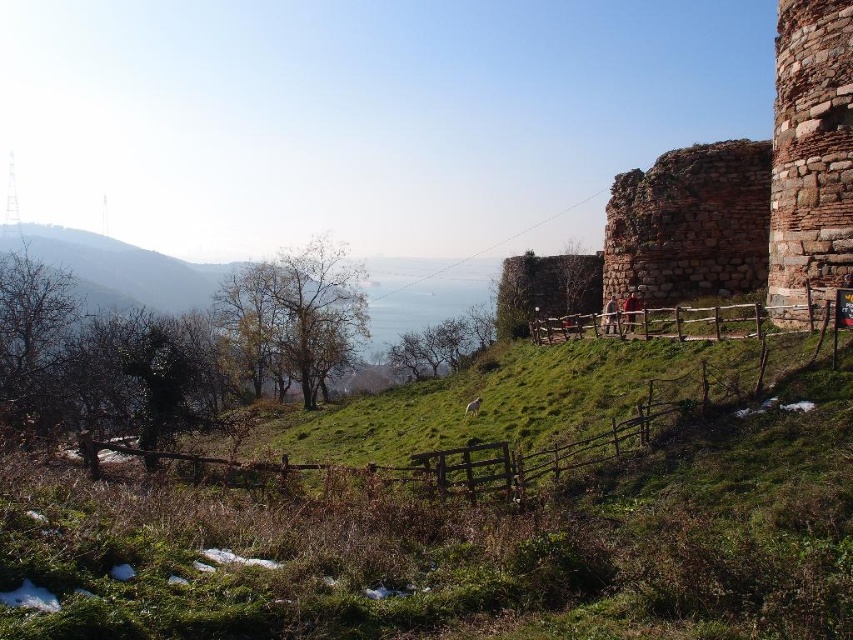
Which is more to the right, green grassy at center or rustic stone wall at upper right?

From the viewer's perspective, rustic stone wall at upper right appears more on the right side.

Is green grassy at center smaller than rustic stone wall at upper right?

Yes.

The image size is (853, 640). I want to click on green grassy at center, so click(471, 512).

Identify the location of green grassy at center. The image size is (853, 640). (471, 512).